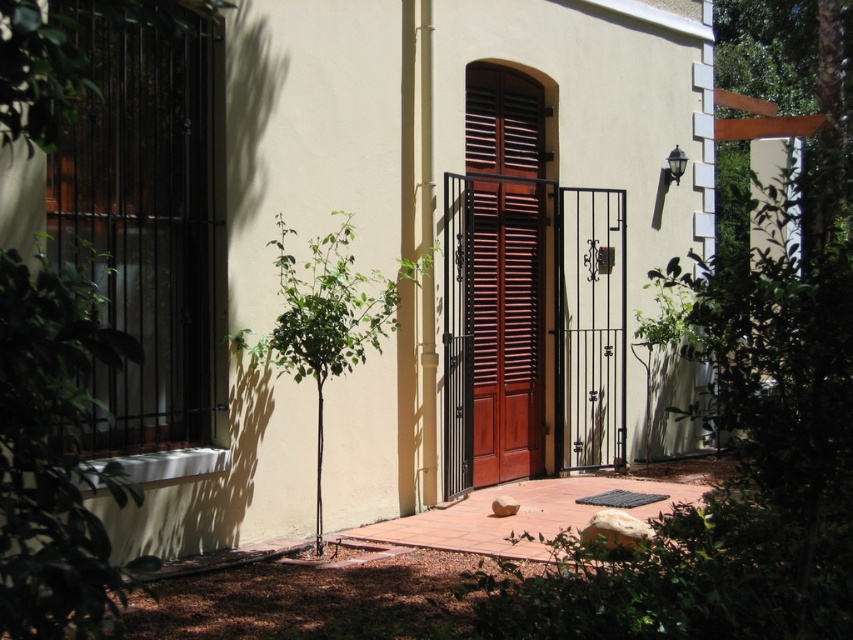
You are a delivery person trying to access the building through the entrance. You see the black matte shutter at left and the brown wooden shutters at center. Which one is narrower and might allow you to slip through if partially open?

The black matte shutter at left has a lesser width compared to brown wooden shutters at center, so it is narrower and might allow you to slip through if partially open.

You are standing in front of the building and notice a point marked at coordinates (x=142, y=221). What object is located at that point?

The object at point (x=142, y=221) is the black matte shutter at left.